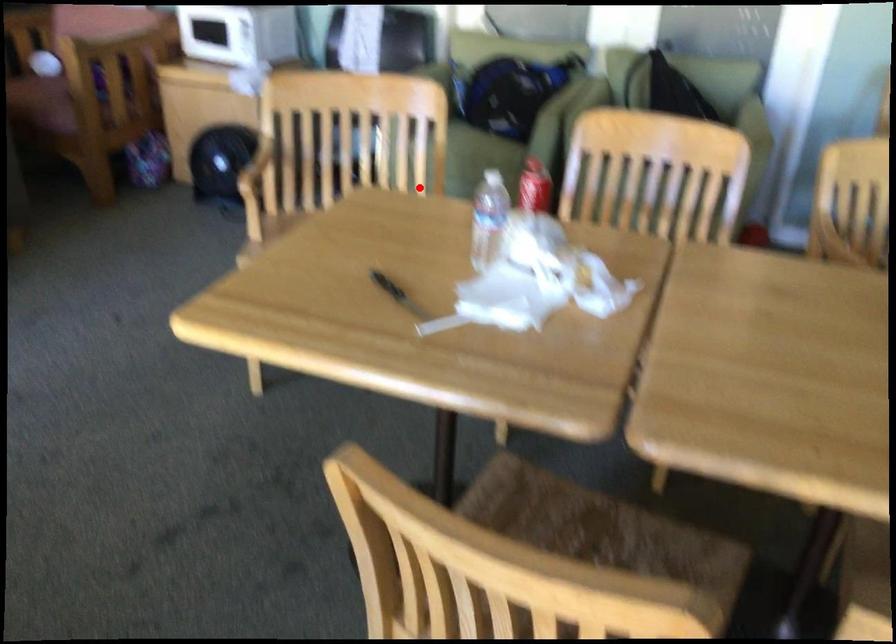
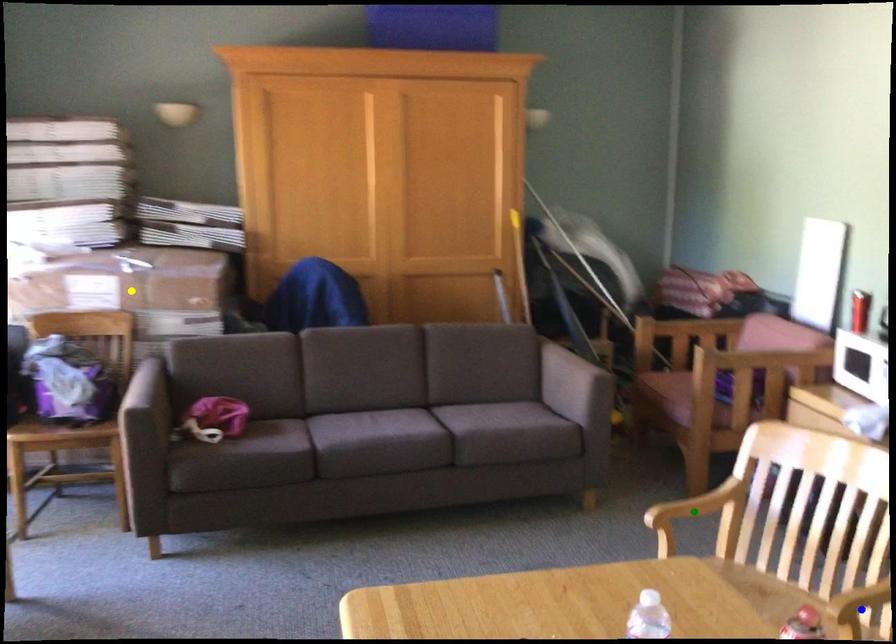
Question: I am providing you with two images of the same scene from different viewpoints. A red point is marked on the first image. You are given multiple points on the second image. Which spot in image 2 lines up with the point in image 1?

Choices:
 (A) blue point
 (B) green point
 (C) yellow point

Answer: (A)